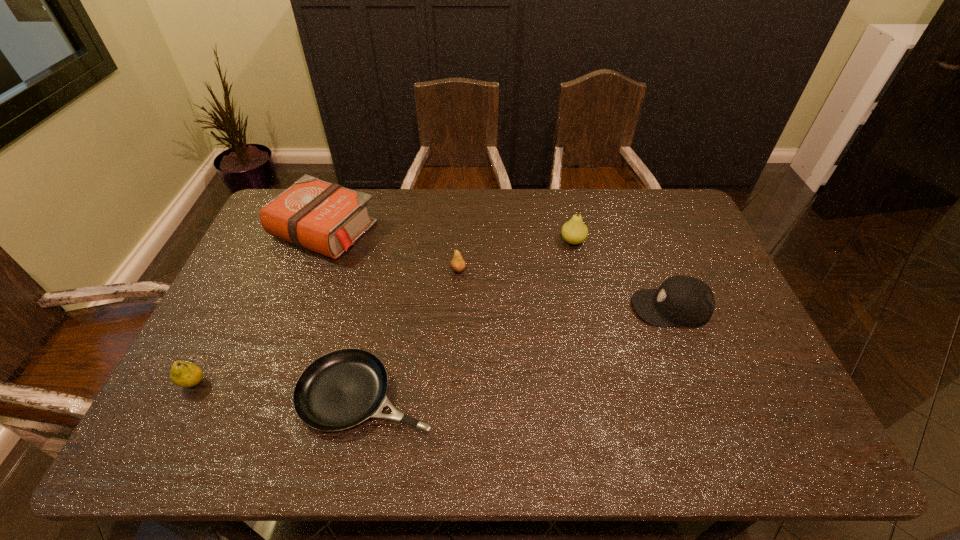
The image size is (960, 540). In order to click on free space located on the back of the Bible in this screenshot , I will do `click(340, 190)`.

At what (x,y) coordinates should I click in order to perform the action: click on vacant space situated 0.160m on the front-facing side of the rightmost object. Please return your answer as a coordinate pair (x, y). This screenshot has width=960, height=540. Looking at the image, I should click on (577, 307).

The width and height of the screenshot is (960, 540). In order to click on free space located on the front-facing side of the rightmost object in this screenshot , I will do `click(566, 307)`.

Locate an element on the screen. free space located on the front-facing side of the rightmost object is located at coordinates (493, 307).

The height and width of the screenshot is (540, 960). Find the location of `free space located 0.260m on the back of the fourth nearest object`. free space located 0.260m on the back of the fourth nearest object is located at coordinates point(461,214).

Locate an element on the screen. free spot located on the back of the leftmost pear is located at coordinates (219, 334).

Where is `vacant space located 0.100m on the left of the shortest object`? vacant space located 0.100m on the left of the shortest object is located at coordinates tap(256, 395).

I want to click on object present at the far edge, so click(x=327, y=218).

Identify the location of object at the near edge. The image size is (960, 540). (341, 389).

Find the location of a particular element. The width and height of the screenshot is (960, 540). Bible located at the left edge is located at coordinates coord(327,218).